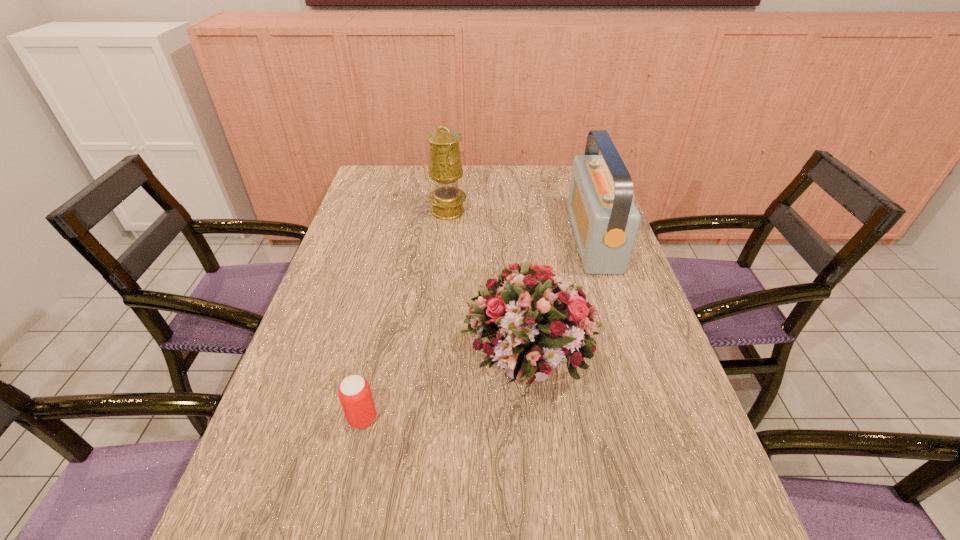
Where is `vacant region that satisfies the following two spatial constraints: 1. on the front-facing side of the rightmost object; 2. on the front side of the shortest object`? This screenshot has width=960, height=540. vacant region that satisfies the following two spatial constraints: 1. on the front-facing side of the rightmost object; 2. on the front side of the shortest object is located at coordinates click(652, 418).

The height and width of the screenshot is (540, 960). Find the location of `vacant region that satisfies the following two spatial constraints: 1. on the back side of the third object from left to right; 2. on the left side of the leftmost object`. vacant region that satisfies the following two spatial constraints: 1. on the back side of the third object from left to right; 2. on the left side of the leftmost object is located at coordinates (372, 373).

At what (x,y) coordinates should I click in order to perform the action: click on free region that satisfies the following two spatial constraints: 1. on the back side of the bouquet; 2. on the right side of the leftmost object. Please return your answer as a coordinate pair (x, y). The width and height of the screenshot is (960, 540). Looking at the image, I should click on (372, 373).